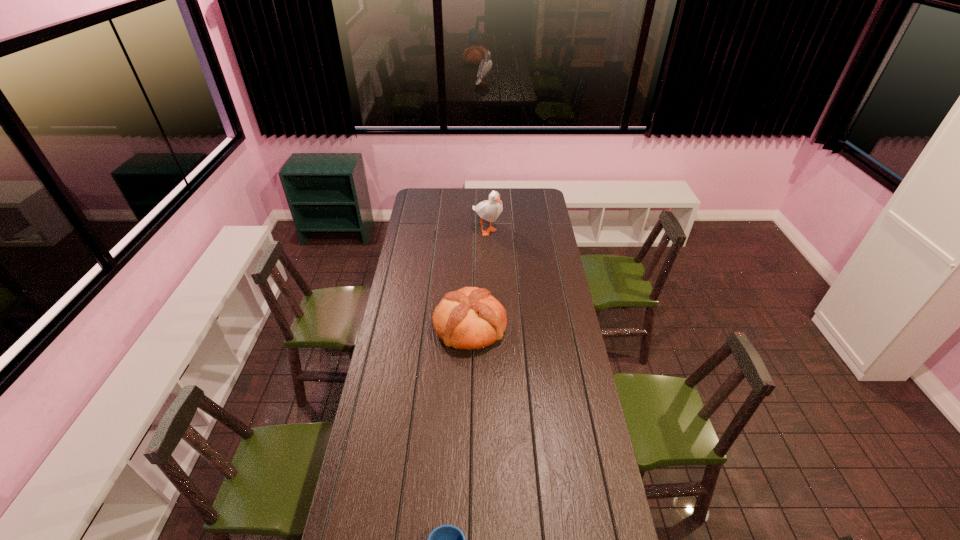
This screenshot has width=960, height=540. I want to click on free space between the second nearest object and the tallest object, so click(478, 278).

What are the coordinates of `free space between the farthest object and the bread` in the screenshot? It's located at (478, 278).

Choose which object is the nearest neighbor to the mug. Please provide its 2D coordinates. Your answer should be formatted as a tuple, i.e. [(x, y)], where the tuple contains the x and y coordinates of a point satisfying the conditions above.

[(470, 318)]

Choose which object is the second nearest neighbor to the second nearest object. Please provide its 2D coordinates. Your answer should be formatted as a tuple, i.e. [(x, y)], where the tuple contains the x and y coordinates of a point satisfying the conditions above.

[(446, 539)]